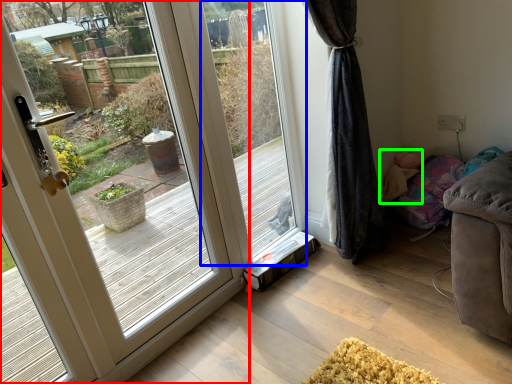
Question: Estimate the real-world distances between objects in this image. Which object is farther from door (highlighted by a red box), window screen (highlighted by a blue box) or child (highlighted by a green box)?

Choices:
 (A) window screen
 (B) child

Answer: (B)